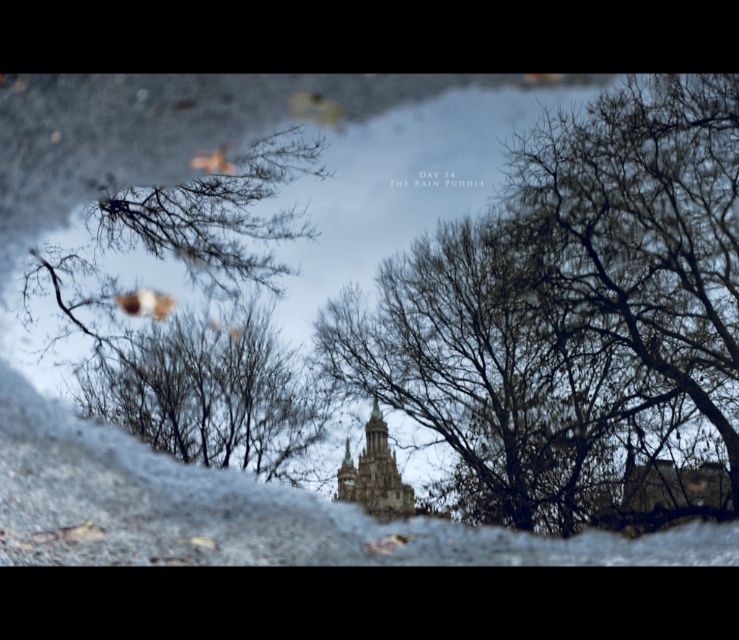
You are an artist sketching the scene through the puddle. You notice the brown matte tree at center and the golden stone bell tower at center reflected in the water. Which object in the reflection is bigger?

The brown matte tree at center is larger in size than the golden stone bell tower at center in the reflection.

Looking at this image, you are standing at the edge of the rain puddle and notice two points in the reflection. The first point is at coordinate point (238, 461) and the second is at point (372, 412). Which point is closer to your eyes?

Point (238, 461) is further to the camera than point (372, 412), so the point closer to your eyes is point (372, 412).

You are standing next to the rain puddle and notice the reflection of the brown matte tree at center and the golden stone bell tower at center. Which object appears higher in the reflection?

The brown matte tree at center appears higher in the reflection because it is located above the golden stone bell tower at center.